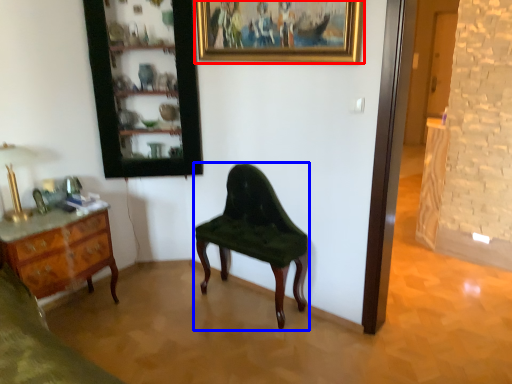
Question: Which object appears closest to the camera in this image, picture frame (highlighted by a red box) or chair (highlighted by a blue box)?

Choices:
 (A) picture frame
 (B) chair

Answer: (A)